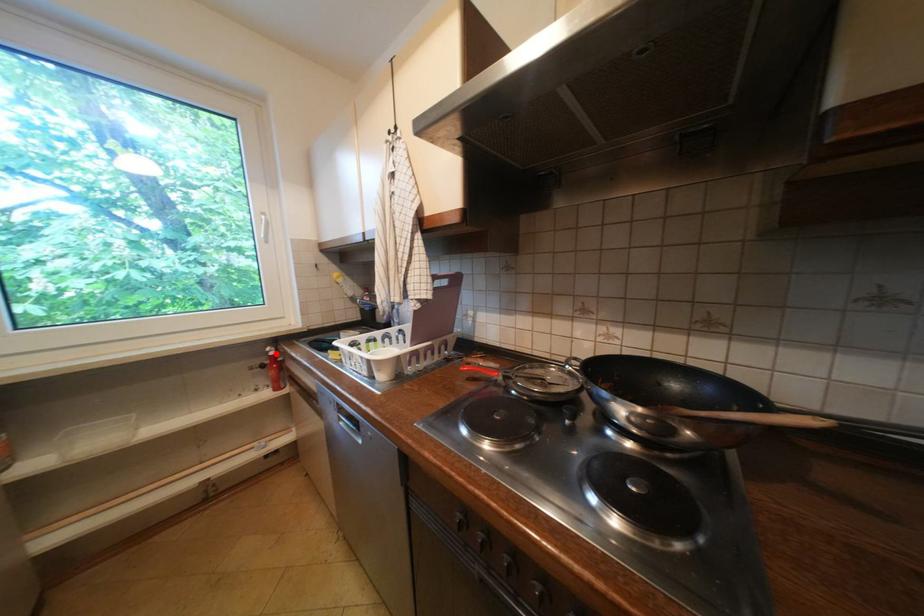
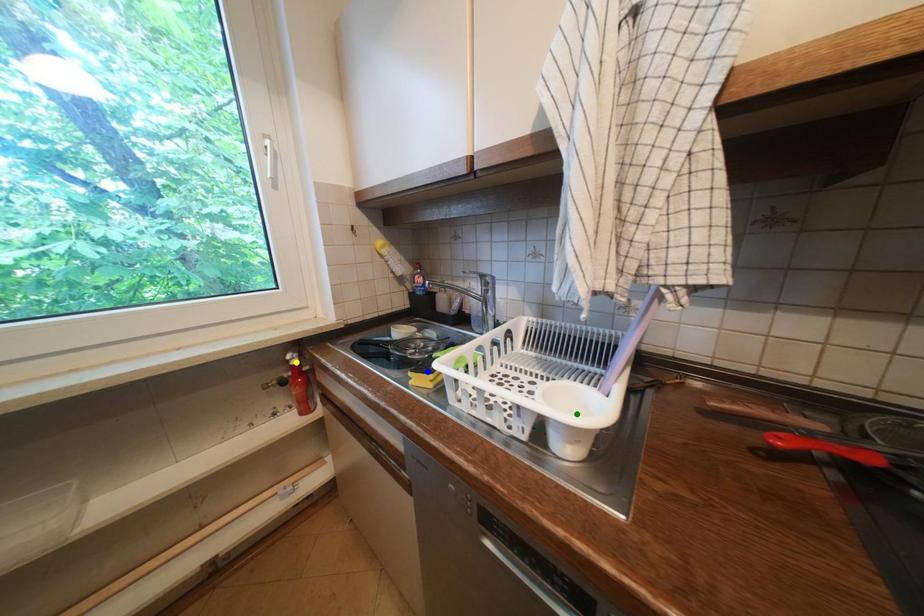
Question: I am providing you with two images of the same scene from different viewpoints. A red point is marked on the first image. You are given multiple points on the second image. In image 2, which mark is for the same physical point as the one in image 1?

Choices:
 (A) green point
 (B) blue point
 (C) yellow point

Answer: (C)